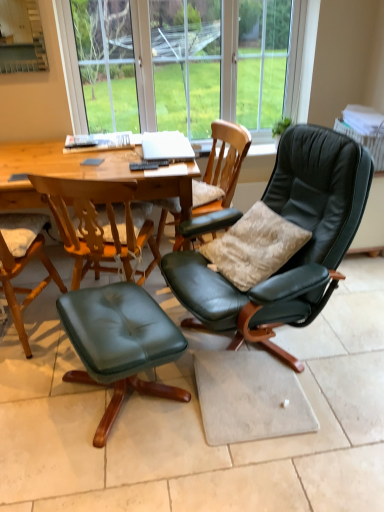
In order to click on matte green leather chair at lower left, acting as the 1th chair starting from the left in this screenshot , I will do `click(23, 263)`.

This screenshot has width=384, height=512. Describe the element at coordinates (220, 169) in the screenshot. I see `matte black leather chair at center, marked as the second chair in a right-to-left arrangement` at that location.

At what (x,y) coordinates should I click in order to perform the action: click on green leather ottoman at lower left. Please return your answer as a coordinate pair (x, y). Image resolution: width=384 pixels, height=512 pixels. Looking at the image, I should click on (120, 343).

From a real-world perspective, which is physically below, green leather ottoman at lower left or matte green leather chair at lower left, the 3th chair in the right-to-left sequence?

green leather ottoman at lower left is physically lower.

There is a green leather ottoman at lower left. At what (x,y) coordinates should I click in order to perform the action: click on the 1st chair above it (from the image's perspective). Please return your answer as a coordinate pair (x, y). The width and height of the screenshot is (384, 512). Looking at the image, I should click on (23, 263).

Considering the relative sizes of green leather ottoman at lower left and matte green leather chair at lower left, acting as the 1th chair starting from the left, in the image provided, is green leather ottoman at lower left wider than matte green leather chair at lower left, acting as the 1th chair starting from the left,?

No.

Which is more distant, (151,325) or (26,256)?

Result: The point (26,256) is behind.

Between green leather ottoman at lower left and velvet beige pillow at center right, which one has larger width?

Wider between the two is green leather ottoman at lower left.

Where is `stool located in front of the velvet beige pillow at center right`? The width and height of the screenshot is (384, 512). stool located in front of the velvet beige pillow at center right is located at coordinates (120, 343).

Considering the sizes of objects green leather ottoman at lower left and velvet beige pillow at center right in the image provided, who is shorter, green leather ottoman at lower left or velvet beige pillow at center right?

Standing shorter between the two is green leather ottoman at lower left.

Is green leather ottoman at lower left oriented away from velvet beige pillow at center right?

Yes, green leather ottoman at lower left is positioned with its back facing velvet beige pillow at center right.

Based on the photo, choose the correct answer: Is wooden round table at center inside green leather ottoman at lower left or outside it?

wooden round table at center is spatially situated outside green leather ottoman at lower left.

Is wooden round table at center not near green leather ottoman at lower left?

wooden round table at center is actually quite close to green leather ottoman at lower left.

How distant is wooden round table at center from green leather ottoman at lower left?

wooden round table at center is 27.12 inches from green leather ottoman at lower left.

Locate an element on the screen. round table behind the green leather ottoman at lower left is located at coordinates (54, 168).

Which of these two, transparent glass bay window at upper center or wooden round table at center, is bigger?

Bigger between the two is wooden round table at center.

Is point (155, 119) closer or farther from the camera than point (50, 170)?

Point (155, 119) is positioned farther from the camera compared to point (50, 170).

This screenshot has height=512, width=384. In order to click on bay window that appears on the right of wooden round table at center in this screenshot , I will do `click(186, 63)`.

Is transparent glass bay window at upper center oriented towards wooden round table at center?

No, transparent glass bay window at upper center does not turn towards wooden round table at center.

Is matte black leather chair at center, which is the second chair from left to right, wider or thinner than transparent glass bay window at upper center?

Considering their sizes, matte black leather chair at center, which is the second chair from left to right, looks broader than transparent glass bay window at upper center.

Is matte black leather chair at center, which is the second chair from left to right, at the left side of transparent glass bay window at upper center?

Indeed, matte black leather chair at center, which is the second chair from left to right, is positioned on the left side of transparent glass bay window at upper center.

Is the depth of matte black leather chair at center, marked as the second chair in a right-to-left arrangement, greater than that of transparent glass bay window at upper center?

No, matte black leather chair at center, marked as the second chair in a right-to-left arrangement, is closer to the camera.

Is matte black leather chair at center, which is the second chair from left to right, not near matte black leather chair at center, the 1th chair viewed from the right?

Actually, matte black leather chair at center, which is the second chair from left to right, and matte black leather chair at center, the 1th chair viewed from the right, are a little close together.

From a real-world perspective, does matte black leather chair at center, which is the second chair from left to right, stand above matte black leather chair at center, the 1th chair viewed from the right?

Incorrect, from a real-world perspective, matte black leather chair at center, which is the second chair from left to right, is lower than matte black leather chair at center, the 1th chair viewed from the right.

Considering the sizes of matte black leather chair at center, which is the second chair from left to right, and matte black leather chair at center, the 1th chair viewed from the right, in the image, is matte black leather chair at center, which is the second chair from left to right, wider or thinner than matte black leather chair at center, the 1th chair viewed from the right,?

Considering their sizes, matte black leather chair at center, which is the second chair from left to right, looks slimmer than matte black leather chair at center, the 1th chair viewed from the right.

Could you tell me if matte black leather chair at center, which is the second chair from left to right, is turned towards matte black leather chair at center, the 1th chair viewed from the right?

No, matte black leather chair at center, which is the second chair from left to right, does not turn towards matte black leather chair at center, the 1th chair viewed from the right.

From a real-world perspective, is matte green leather chair at lower left, the 3th chair in the right-to-left sequence, positioned above or below transparent glass bay window at upper center?

matte green leather chair at lower left, the 3th chair in the right-to-left sequence, is situated lower than transparent glass bay window at upper center in the real world.

Does matte green leather chair at lower left, the 3th chair in the right-to-left sequence, come behind transparent glass bay window at upper center?

That is False.

Is point (4, 231) positioned in front of point (82, 47)?

Yes, point (4, 231) is in front of point (82, 47).

Which is correct: matte green leather chair at lower left, acting as the 1th chair starting from the left, is inside transparent glass bay window at upper center, or outside of it?

matte green leather chair at lower left, acting as the 1th chair starting from the left, is located beyond the bounds of transparent glass bay window at upper center.

At what (x,y) coordinates should I click in order to perform the action: click on chair lying on the left of green leather ottoman at lower left. Please return your answer as a coordinate pair (x, y). Looking at the image, I should click on (23, 263).

What are the coordinates of `pillow above the green leather ottoman at lower left (from a real-world perspective)` in the screenshot? It's located at (254, 247).

Considering their positions, is wooden round table at center positioned closer to green leather ottoman at lower left than matte green leather chair at lower left, the 3th chair in the right-to-left sequence?

The object closer to green leather ottoman at lower left is matte green leather chair at lower left, the 3th chair in the right-to-left sequence.

Looking at the image, which one is located further to transparent glass bay window at upper center, velvet beige pillow at center right or matte black leather chair at center, the 1th chair viewed from the right?

velvet beige pillow at center right.

Looking at the image, which one is located further to wooden round table at center, matte black leather chair at center, the 1th chair viewed from the right, or matte black leather chair at center, which is the second chair from left to right?

The object further to wooden round table at center is matte black leather chair at center, the 1th chair viewed from the right.

Looking at the image, which one is located further to wooden round table at center, matte green leather chair at lower left, the 3th chair in the right-to-left sequence, or green leather ottoman at lower left?

Based on the image, green leather ottoman at lower left appears to be further to wooden round table at center.

Considering their positions, is velvet beige pillow at center right positioned closer to wooden round table at center than matte black leather chair at center, which is the second chair from left to right?

The object closer to wooden round table at center is matte black leather chair at center, which is the second chair from left to right.

Which object lies further to the anchor point matte green leather chair at lower left, the 3th chair in the right-to-left sequence, wooden round table at center or matte black leather chair at center, which is the second chair from left to right?

matte black leather chair at center, which is the second chair from left to right, is further to matte green leather chair at lower left, the 3th chair in the right-to-left sequence.

Consider the image. Considering their positions, is matte black leather chair at center, marked as the second chair in a right-to-left arrangement, positioned closer to wooden round table at center than green leather ottoman at lower left?

matte black leather chair at center, marked as the second chair in a right-to-left arrangement.

When comparing their distances from matte green leather chair at lower left, the 3th chair in the right-to-left sequence, does matte black leather chair at center, marked as the second chair in a right-to-left arrangement, or wooden round table at center seem closer?

wooden round table at center lies closer to matte green leather chair at lower left, the 3th chair in the right-to-left sequence, than the other object.

At what (x,y) coordinates should I click in order to perform the action: click on stool between matte green leather chair at lower left, acting as the 1th chair starting from the left, and velvet beige pillow at center right. Please return your answer as a coordinate pair (x, y). The width and height of the screenshot is (384, 512). Looking at the image, I should click on (120, 343).

Locate an element on the screen. This screenshot has height=512, width=384. stool between wooden round table at center and velvet beige pillow at center right in the horizontal direction is located at coordinates (x=120, y=343).

Identify the location of round table that lies between transparent glass bay window at upper center and green leather ottoman at lower left from top to bottom. The image size is (384, 512). (54, 168).

Find the location of a particular element. pillow between matte black leather chair at center, marked as the 3th chair in a left-to-right arrangement, and matte black leather chair at center, marked as the second chair in a right-to-left arrangement, from front to back is located at coordinates (254, 247).